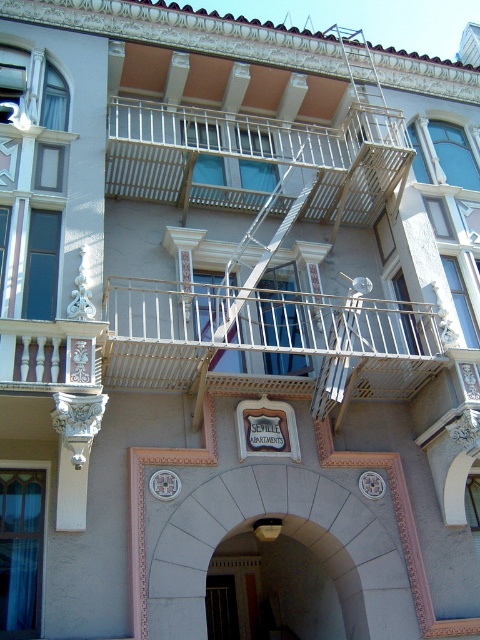
You are standing in front of the Seville Apartments and want to determine which white metal railing is closer to you. The railings are labeled as the white metal railing at center and the white metal railing at upper center. Which one is nearer?

The white metal railing at center is closer to the viewer than the white metal railing at upper center.